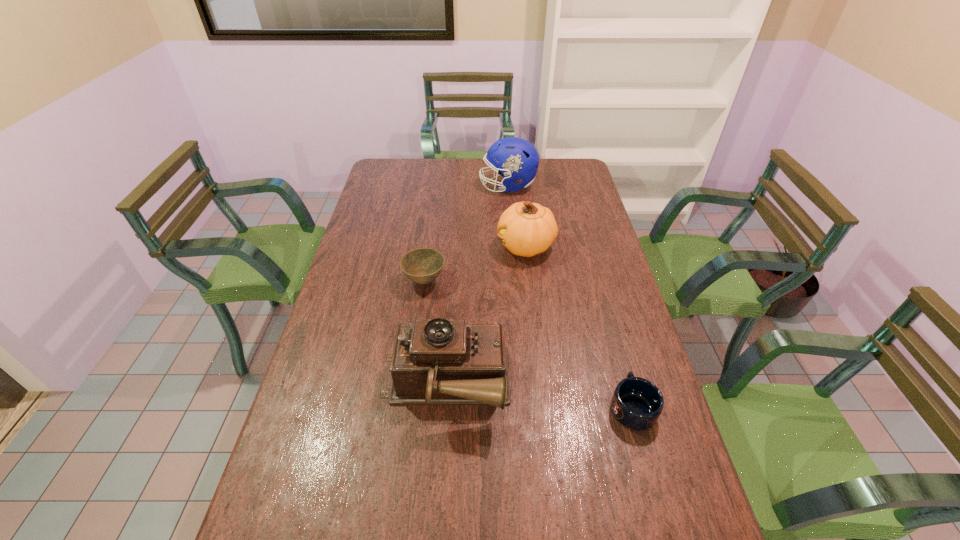
This screenshot has width=960, height=540. Find the location of `free space at the far edge of the desktop`. free space at the far edge of the desktop is located at coordinates (450, 173).

Find the location of `vacant space at the left edge`. vacant space at the left edge is located at coordinates [x=365, y=218].

This screenshot has width=960, height=540. Identify the location of vacant region at the right edge of the desktop. (556, 198).

Locate an element on the screen. vacant space at the far left corner of the desktop is located at coordinates (403, 178).

This screenshot has height=540, width=960. Identify the location of empty location between the pumpkin and the mug. (579, 327).

The height and width of the screenshot is (540, 960). In order to click on vacant space that's between the farthest object and the phonograph_record in this screenshot , I will do `click(477, 286)`.

Locate an element on the screen. The height and width of the screenshot is (540, 960). vacant area that lies between the phonograph_record and the mug is located at coordinates (539, 396).

Where is `free spot between the phonograph_record and the farthest object`? The height and width of the screenshot is (540, 960). free spot between the phonograph_record and the farthest object is located at coordinates (477, 286).

Identify the location of unoccupied position between the mug and the phonograph_record. This screenshot has height=540, width=960. (539, 396).

I want to click on vacant area that lies between the second farthest object and the third nearest object, so 475,264.